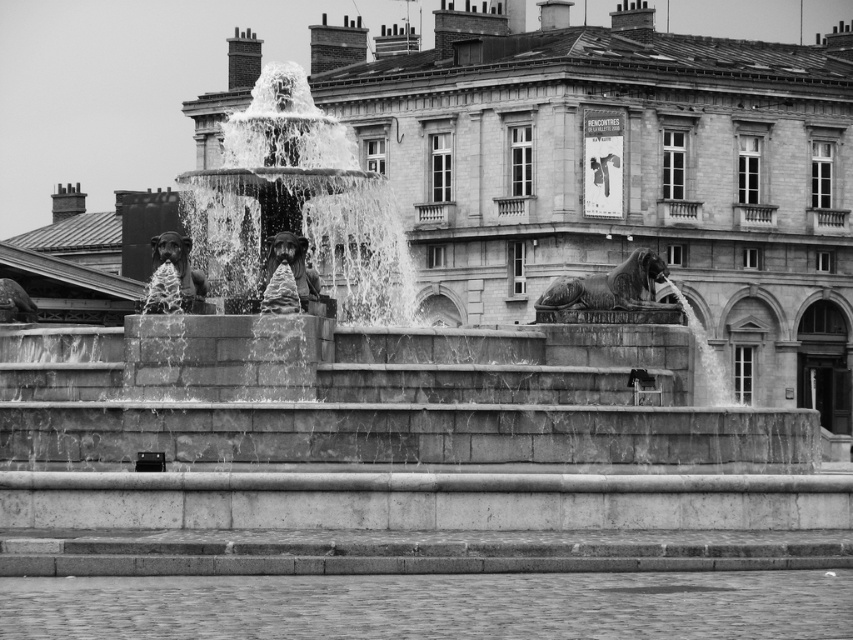
Where is `polished bronze lion at center`? polished bronze lion at center is located at coordinates (181, 269).

Can you confirm if polished bronze lion at center is positioned above bronze statue at left?

Correct, polished bronze lion at center is located above bronze statue at left.

Between point (180, 298) and point (20, 296), which one is positioned in front?

Point (180, 298) is more forward.

The height and width of the screenshot is (640, 853). Find the location of `polished bronze lion at center`. polished bronze lion at center is located at coordinates (181, 269).

Is bronze lion at center bigger than polished bronze statue at center?

Yes.

Between bronze lion at center and polished bronze statue at center, which one has more height?

With more height is bronze lion at center.

Who is more forward, (635, 301) or (306, 292)?

Point (306, 292)

You are a GUI agent. You are given a task and a screenshot of the screen. Output one action in this format:
    pyautogui.click(x=<x>, y=<y>)
    Task: Click on the bronze lion at center
    The image size is (853, 640).
    Given the screenshot: What is the action you would take?
    pyautogui.click(x=608, y=294)

Between bronze lion at center and bronze statue at left, which one appears on the left side from the viewer's perspective?

bronze statue at left

Is point (556, 294) less distant than point (16, 296)?

Yes, point (556, 294) is in front of point (16, 296).

Find the location of `bronze lion at center`. bronze lion at center is located at coordinates (x=608, y=294).